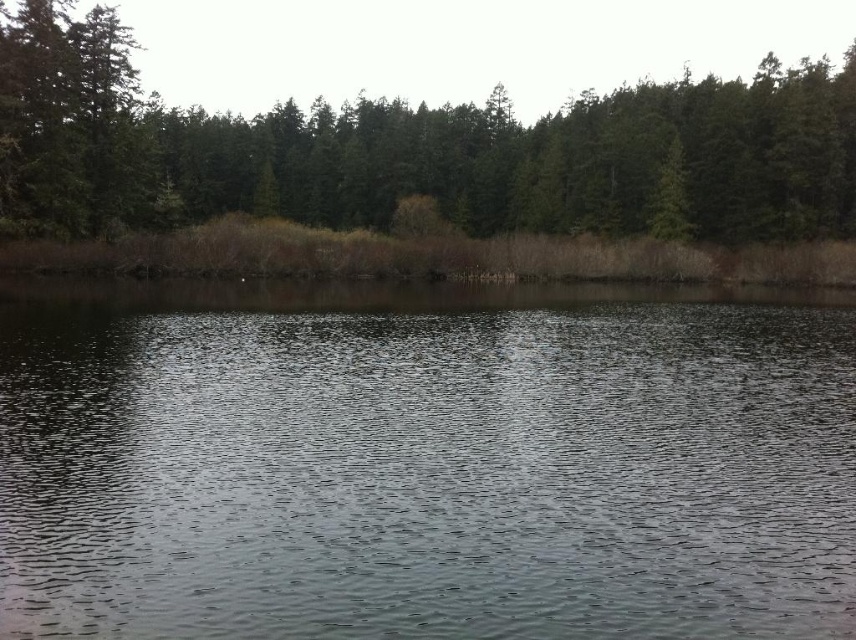
You are standing at the edge of the water and want to take a photo of both the clear water at center and the green matte trees at upper center. Which object should you adjust your camera to focus on first if you want to capture both in the same frame?

You should focus on the green matte trees at upper center first because the clear water at center is positioned to the right of them, so adjusting focus starting from the trees will help ensure both are in the frame.

You are standing at the center of the image and want to locate the clear water at center. According to the coordinates given, in which direction should you move to reach it?

The clear water at center is located at coordinates point (425, 461). Since you are at the center of the image, which is typically at point (428, 320), you should move to the right and slightly upward to reach it.

You are standing at the edge of the lake and want to determine which of the two points, point (57, 397) or point (131, 212), is closer to you. Based on the scene description, which point is nearer?

Point (57, 397) is closer to the viewer than point (131, 212).